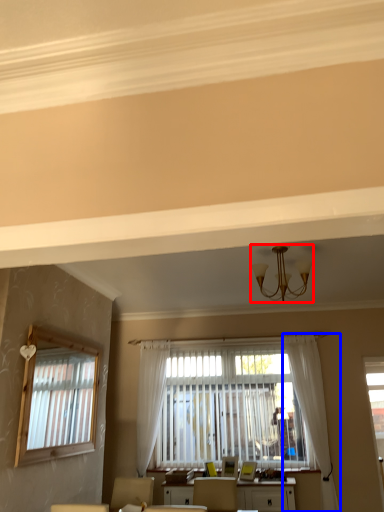
Question: Which of the following is the farthest to the observer, light fixture (highlighted by a red box) or curtain (highlighted by a blue box)?

Choices:
 (A) light fixture
 (B) curtain

Answer: (B)